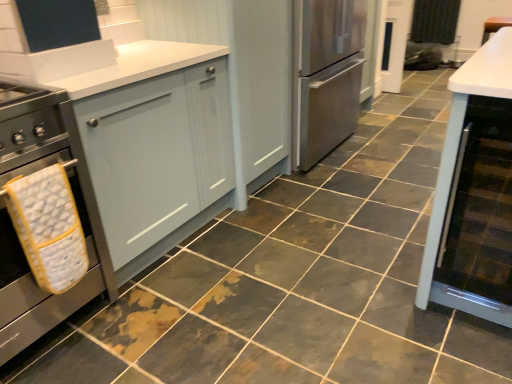
Question: Can you confirm if matte glass cabinet at right, positioned as the 1th cabinetry in right-to-left order, is shorter than yellow fabric oven mitt at left?

Choices:
 (A) no
 (B) yes

Answer: (A)

Question: Is matte glass cabinet at right, which is the third cabinetry in left-to-right order, positioned beyond the bounds of yellow fabric oven mitt at left?

Choices:
 (A) yes
 (B) no

Answer: (A)

Question: Is matte glass cabinet at right, positioned as the 1th cabinetry in right-to-left order, not near yellow fabric oven mitt at left?

Choices:
 (A) yes
 (B) no

Answer: (A)

Question: Is matte glass cabinet at right, which is the third cabinetry in left-to-right order, wider than yellow fabric oven mitt at left?

Choices:
 (A) yes
 (B) no

Answer: (A)

Question: Is matte glass cabinet at right, positioned as the 1th cabinetry in right-to-left order, bigger than yellow fabric oven mitt at left?

Choices:
 (A) no
 (B) yes

Answer: (B)

Question: Is matte glass cabinet at right, positioned as the 1th cabinetry in right-to-left order, next to yellow fabric oven mitt at left and touching it?

Choices:
 (A) yes
 (B) no

Answer: (B)

Question: From a real-world perspective, is matte gray cabinet at center, placed as the 2th cabinetry when sorted from left to right, on matte gray cabinet at left, which is the 1th cabinetry in left-to-right order?

Choices:
 (A) no
 (B) yes

Answer: (B)

Question: Is matte gray cabinet at center, placed as the 2th cabinetry when sorted from left to right, positioned behind matte gray cabinet at left, which is the 1th cabinetry in left-to-right order?

Choices:
 (A) yes
 (B) no

Answer: (A)

Question: Is matte gray cabinet at center, placed as the 2th cabinetry when sorted from left to right, not within matte gray cabinet at left, which is the 1th cabinetry in left-to-right order?

Choices:
 (A) no
 (B) yes

Answer: (B)

Question: Is matte gray cabinet at center, positioned as the second cabinetry in right-to-left order, bigger than matte gray cabinet at left, which is the 1th cabinetry in left-to-right order?

Choices:
 (A) yes
 (B) no

Answer: (A)

Question: Could you tell me if matte gray cabinet at center, positioned as the second cabinetry in right-to-left order, is turned towards matte gray cabinet at left, which is the 1th cabinetry in left-to-right order?

Choices:
 (A) no
 (B) yes

Answer: (A)

Question: Can you confirm if black fabric curtain at upper right is positioned to the right of matte gray cabinet at center, positioned as the second cabinetry in right-to-left order?

Choices:
 (A) no
 (B) yes

Answer: (B)